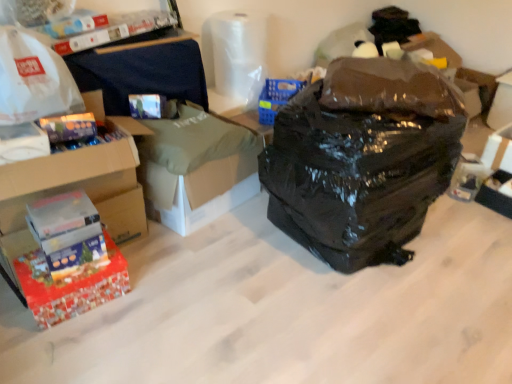
Question: Would you consider black plastic storage box at lower right, which ranks as the 1th storage box in bottom-to-top order, to be distant from red cardboard box at lower left, which is the second box in top-to-bottom order?

Choices:
 (A) yes
 (B) no

Answer: (A)

Question: Is black plastic storage box at lower right, the 3th storage box in the back-to-front sequence, not inside red cardboard box at lower left, marked as the second box in a bottom-to-top arrangement?

Choices:
 (A) no
 (B) yes

Answer: (B)

Question: Considering the relative sizes of black plastic storage box at lower right, which ranks as the 3th storage box in top-to-bottom order, and red cardboard box at lower left, which is the second box in top-to-bottom order, in the image provided, is black plastic storage box at lower right, which ranks as the 3th storage box in top-to-bottom order, smaller than red cardboard box at lower left, which is the second box in top-to-bottom order,?

Choices:
 (A) no
 (B) yes

Answer: (B)

Question: Could you tell me if black plastic storage box at lower right, arranged as the 1th storage box when viewed from the front, is facing red cardboard box at lower left, marked as the second box in a bottom-to-top arrangement?

Choices:
 (A) no
 (B) yes

Answer: (A)

Question: Is black plastic storage box at lower right, the 3th storage box in the back-to-front sequence, taller than red cardboard box at lower left, marked as the second box in a bottom-to-top arrangement?

Choices:
 (A) no
 (B) yes

Answer: (A)

Question: Is red cardboard box at lower left, marked as the second box in a bottom-to-top arrangement, surrounded by black plastic storage box at lower right, arranged as the 1th storage box when viewed from the front?

Choices:
 (A) no
 (B) yes

Answer: (A)

Question: Is white cardboard box at right, acting as the second storage box starting from the back, positioned beyond the bounds of transparent plastic toilet paper at upper center?

Choices:
 (A) no
 (B) yes

Answer: (B)

Question: Is white cardboard box at right, acting as the second storage box starting from the back, looking in the opposite direction of transparent plastic toilet paper at upper center?

Choices:
 (A) yes
 (B) no

Answer: (B)

Question: Does white cardboard box at right, acting as the second storage box starting from the back, appear on the left side of transparent plastic toilet paper at upper center?

Choices:
 (A) no
 (B) yes

Answer: (A)

Question: Does white cardboard box at right, the second storage box from the bottom, have a smaller size compared to transparent plastic toilet paper at upper center?

Choices:
 (A) yes
 (B) no

Answer: (A)

Question: Could you tell me if white cardboard box at right, the second storage box from the bottom, is facing transparent plastic toilet paper at upper center?

Choices:
 (A) yes
 (B) no

Answer: (B)

Question: Does white cardboard box at right, the 2th storage box from the front, have a lesser width compared to transparent plastic toilet paper at upper center?

Choices:
 (A) yes
 (B) no

Answer: (B)

Question: Is white cardboard box at center smaller than red glossy box at lower left, the 1th box from the bottom?

Choices:
 (A) no
 (B) yes

Answer: (A)